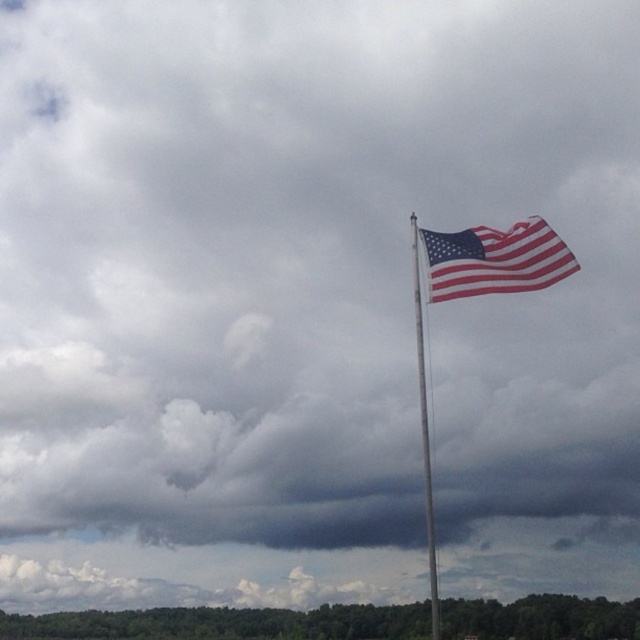
Question: Which object is farther from the camera taking this photo?

Choices:
 (A) red-white striped fabric flag at upper right
 (B) silver metallic flag pole at upper right

Answer: (A)

Question: Which point is closer to the camera?

Choices:
 (A) (458, 296)
 (B) (412, 262)

Answer: (A)

Question: Observing the image, what is the correct spatial positioning of red-white striped fabric flag at upper right in reference to silver metallic flag pole at upper right?

Choices:
 (A) left
 (B) right

Answer: (A)

Question: Does red-white striped fabric flag at upper right appear on the left side of silver metallic flag pole at upper right?

Choices:
 (A) no
 (B) yes

Answer: (B)

Question: Can you confirm if red-white striped fabric flag at upper right is positioned above silver metallic flag pole at upper right?

Choices:
 (A) yes
 (B) no

Answer: (A)